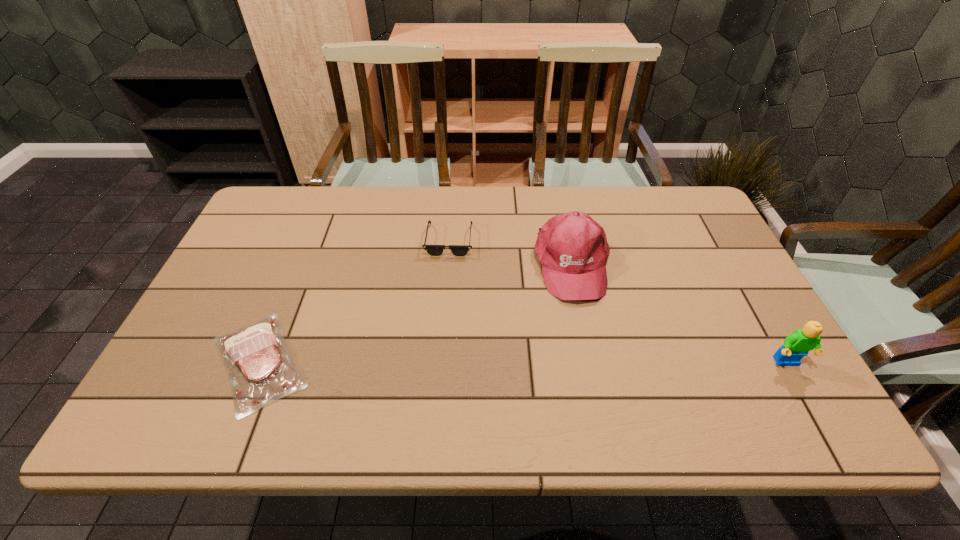
Locate an element on the screen. object that is positioned at the near right corner is located at coordinates (797, 345).

In order to click on vacant space at the far edge in this screenshot , I will do (358, 229).

Where is `free point at the near edge`? The height and width of the screenshot is (540, 960). free point at the near edge is located at coordinates (497, 390).

In order to click on vacant space at the left edge in this screenshot , I will do [231, 280].

Identify the location of blank area at the right edge. (740, 323).

In the image, there is a desktop. Where is `free space at the far left corner`? This screenshot has height=540, width=960. free space at the far left corner is located at coordinates (285, 188).

Locate an element on the screen. Image resolution: width=960 pixels, height=540 pixels. vacant space at the far right corner of the desktop is located at coordinates (676, 194).

Identify the location of empty location between the leftmost object and the baseball cap. (416, 313).

The height and width of the screenshot is (540, 960). I want to click on blank region between the second object from right to left and the steak, so click(416, 313).

I want to click on empty space that is in between the baseball cap and the rightmost object, so click(x=680, y=314).